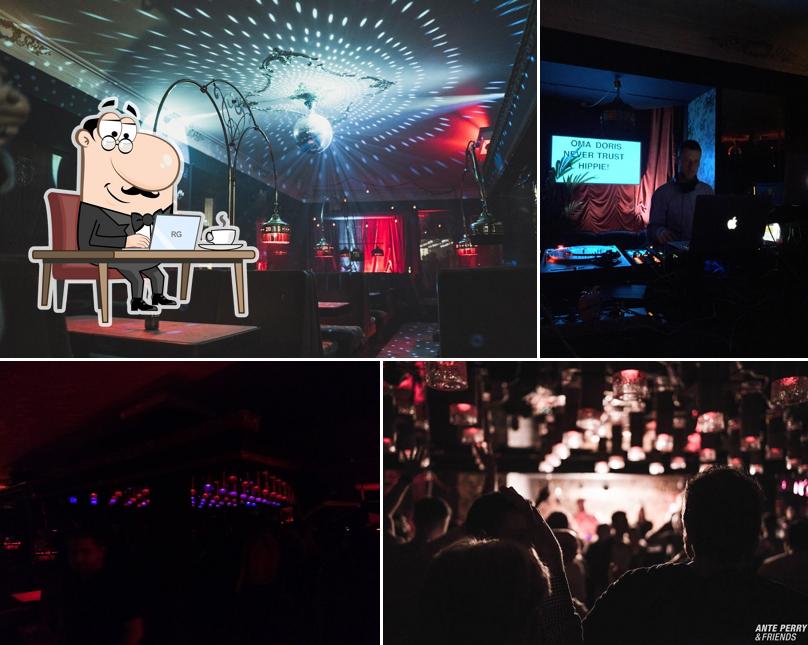
Locate an element on the screen. This screenshot has height=645, width=808. chair is located at coordinates point(65,219).